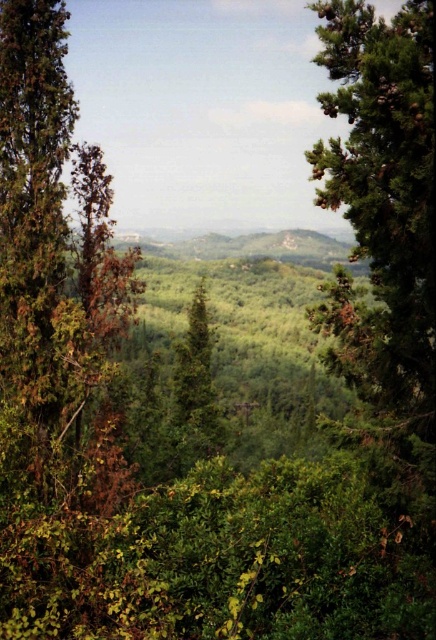
Can you confirm if green textured pine tree at right is wider than green textured tree at center?

Incorrect, green textured pine tree at right's width does not surpass green textured tree at center's.

Is point (395, 333) behind point (190, 390)?

No, it is in front of (190, 390).

This screenshot has height=640, width=436. Identify the location of green textured pine tree at right. pyautogui.click(x=385, y=189).